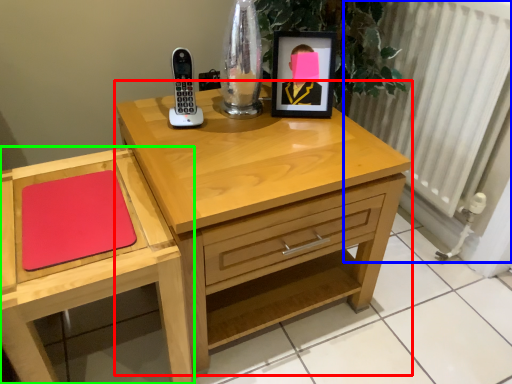
Question: Which is farther away from nightstand (highlighted by a red box)? radiator (highlighted by a blue box) or chest of drawers (highlighted by a green box)?

Choices:
 (A) radiator
 (B) chest of drawers

Answer: (A)